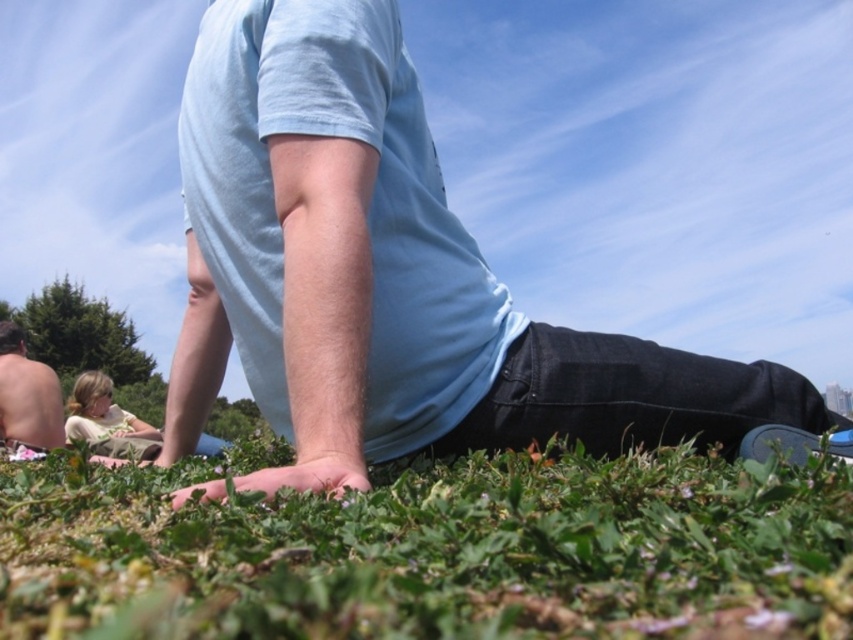
Consider the image. You are a landscape architect designing a new park. You need to place a 10 feet long bench between the green grass at lower center and the shiny silver torso at lower left. Is there enough space between them to fit the bench?

The distance between the green grass at lower center and the shiny silver torso at lower left is 11.30 feet. Since the bench is 10 feet long, there is enough space to place it between them.

You are a photographer setting up a shot of the scene. You need to ensure that the light blue cotton shirt at center and the shiny silver torso at lower left are both in focus. Given their sizes, which object should you prioritize focusing on first to ensure clarity?

The light blue cotton shirt at center is larger in size than the shiny silver torso at lower left, so you should prioritize focusing on the light blue cotton shirt at center first to ensure clarity.